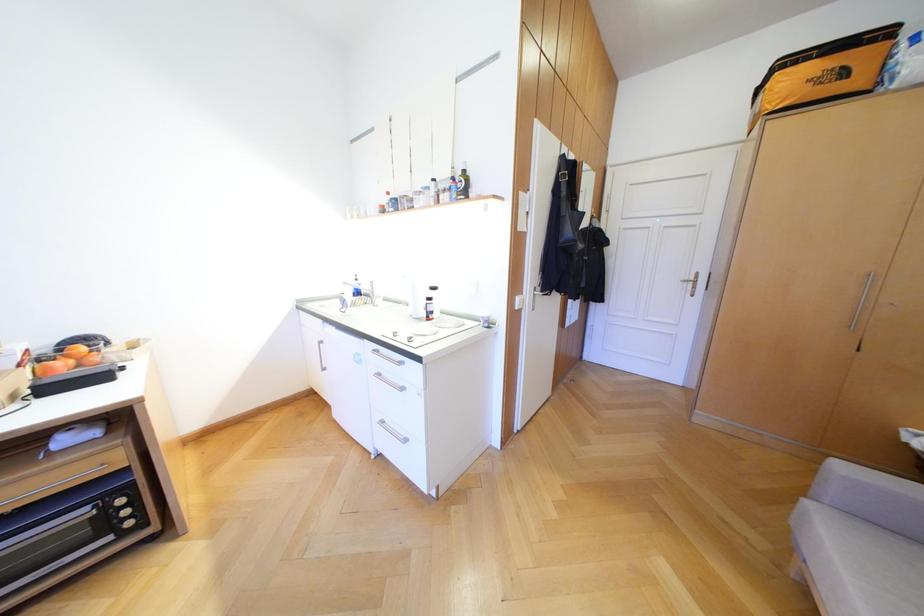
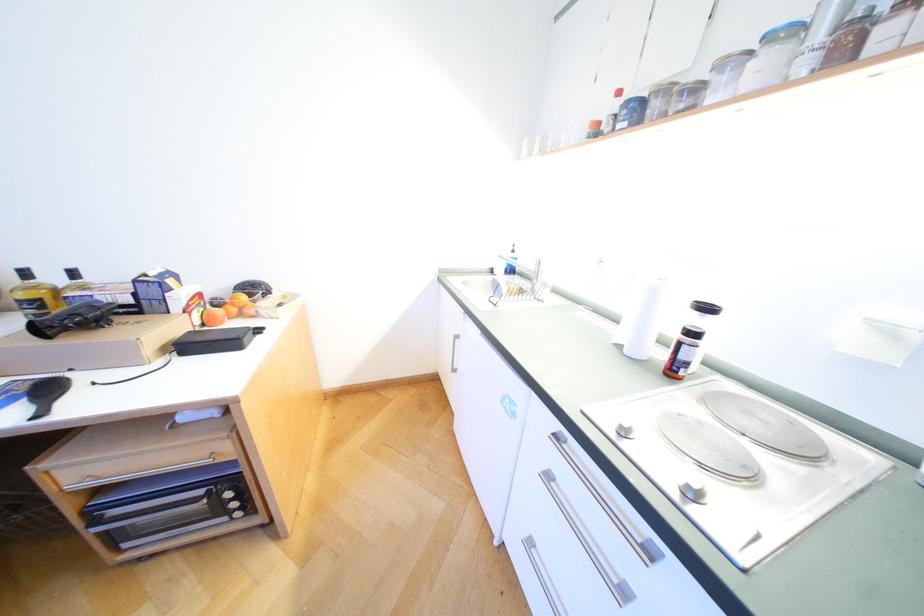
Question: Based on the continuous images, in which direction is the camera rotating? Reply with the corresponding letter.

Choices:
 (A) Left
 (B) Right
 (C) Up
 (D) Down

Answer: (A)